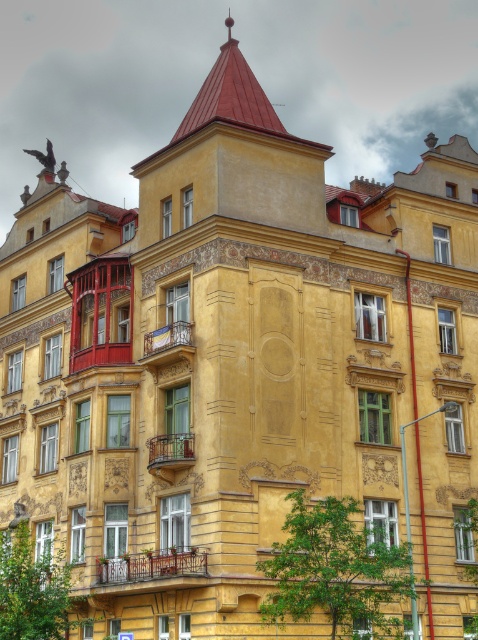
Question: Is metallic wrought iron balcony at upper center bigger than metallic wrought iron balcony at center?

Choices:
 (A) yes
 (B) no

Answer: (A)

Question: Is rustic wooden balcony at lower center bigger than metallic wrought iron balcony at upper center?

Choices:
 (A) no
 (B) yes

Answer: (A)

Question: Which of the following is the closest to the observer?

Choices:
 (A) metallic wrought iron balcony at upper center
 (B) metallic wrought iron balcony at center
 (C) rustic wooden balcony at lower center

Answer: (C)

Question: Which point appears closest to the camera in this image?

Choices:
 (A) (192, 324)
 (B) (105, 560)
 (C) (187, 440)

Answer: (C)

Question: Does rustic wooden balcony at lower center appear over metallic wrought iron balcony at center?

Choices:
 (A) no
 (B) yes

Answer: (A)

Question: Among these points, which one is farthest from the camera?

Choices:
 (A) [x=149, y=358]
 (B) [x=181, y=445]
 (C) [x=181, y=563]

Answer: (A)